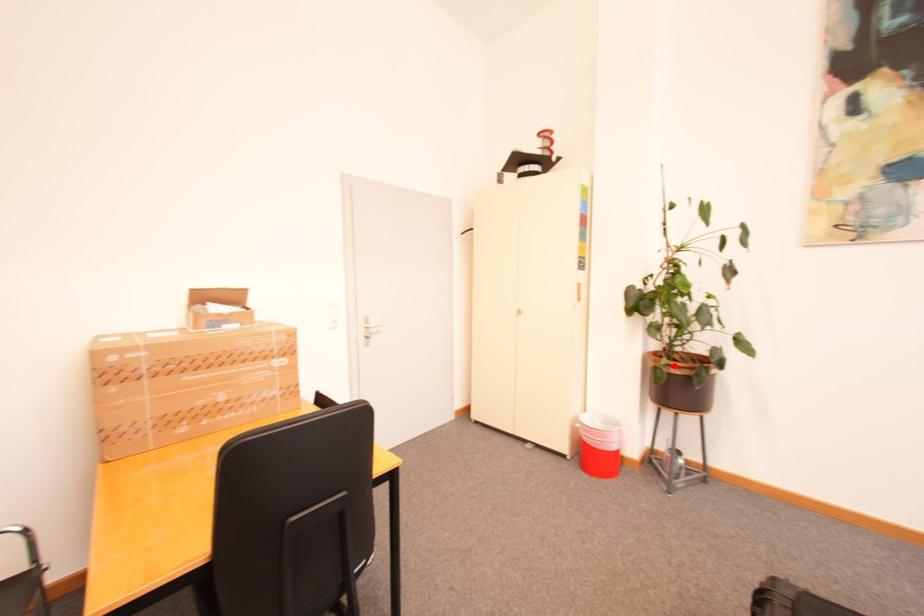
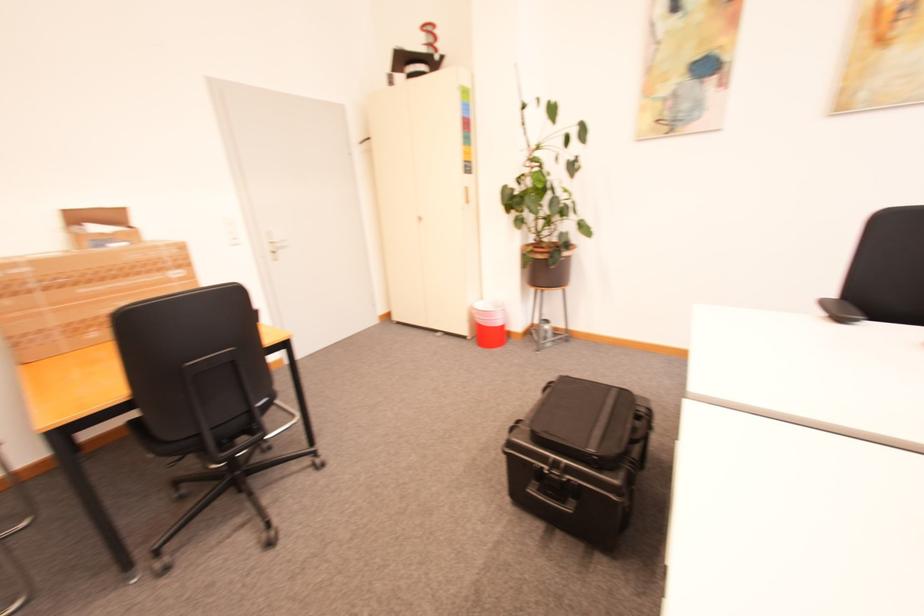
Question: I am providing you with two images of the same scene from different viewpoints. Given a red point in image1, look at the same physical point in image2. Is it:

Choices:
 (A) Closer to the viewpoint
 (B) Farther from the viewpoint

Answer: (A)